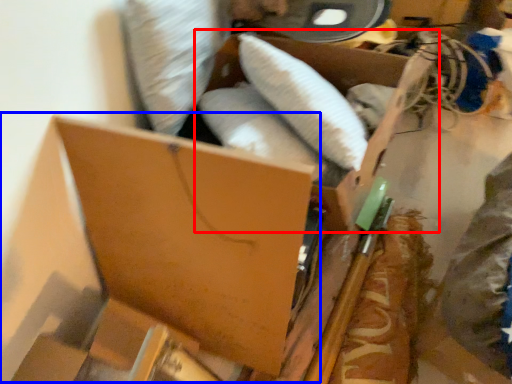
Question: Which of the following is the closest to the observer, storage box (highlighted by a red box) or storage box (highlighted by a blue box)?

Choices:
 (A) storage box
 (B) storage box

Answer: (B)